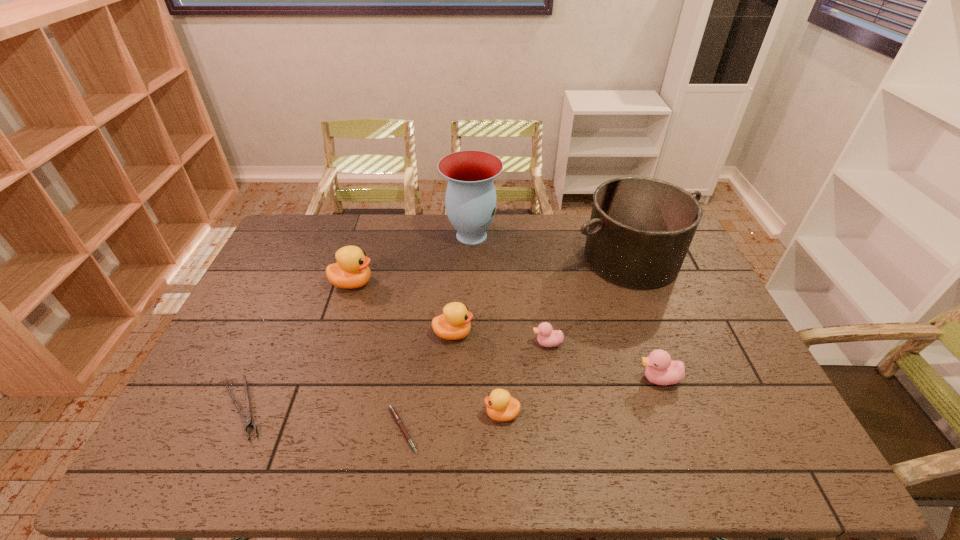
Locate an element on the screen. The image size is (960, 540). vacant space located 0.110m on the face of the second duckling from left to right is located at coordinates (511, 334).

The image size is (960, 540). I want to click on blank space located 0.320m on the front-facing side of the bigger pink duckling, so click(517, 379).

You are a GUI agent. You are given a task and a screenshot of the screen. Output one action in this format:
    pyautogui.click(x=<x>, y=<y>)
    Task: Click on the vacant space located 0.140m on the front-facing side of the bigger pink duckling
    This screenshot has height=540, width=960.
    Given the screenshot: What is the action you would take?
    (585, 379)

Locate an element on the screen. vacant space located 0.400m on the front-facing side of the bigger pink duckling is located at coordinates pos(488,379).

Find the location of a particular element. The width and height of the screenshot is (960, 540). vacant region located 0.200m on the face of the rightmost yellow duckling is located at coordinates (405, 414).

This screenshot has width=960, height=540. What are the coordinates of `free space located 0.320m on the face of the rightmost yellow duckling` in the screenshot? It's located at (357, 414).

The height and width of the screenshot is (540, 960). In order to click on vacant region located 0.060m on the face of the rightmost yellow duckling in this screenshot , I will do `click(461, 414)`.

I want to click on free space located 0.300m on the front-facing side of the left pink duckling, so click(x=428, y=343).

You are a GUI agent. You are given a task and a screenshot of the screen. Output one action in this format:
    pyautogui.click(x=<x>, y=<y>)
    Task: Click on the vacant space situated 0.340m on the front-facing side of the left pink duckling
    
    Given the screenshot: What is the action you would take?
    pyautogui.click(x=415, y=343)

I want to click on vacant space situated on the front-facing side of the left pink duckling, so coord(445,343).